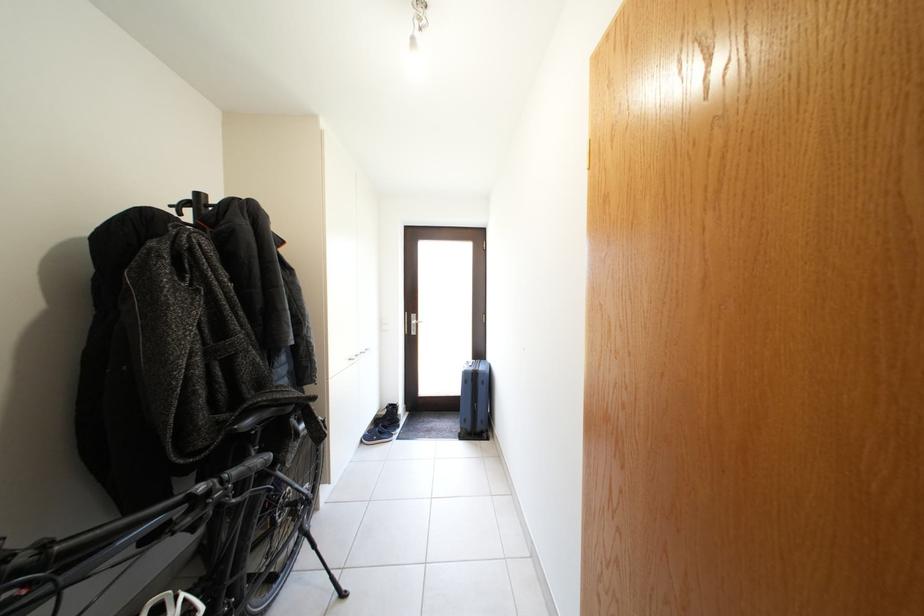
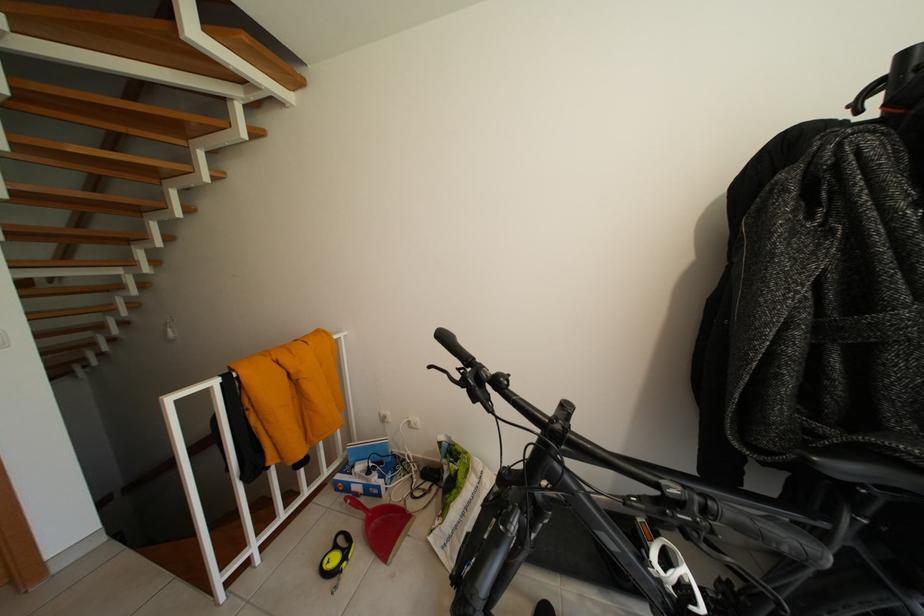
In the second image, find the point that corresponds to point (216, 499) in the first image.

(688, 509)